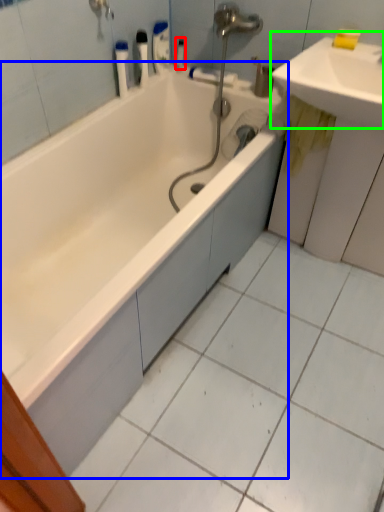
Question: Based on their relative distances, which object is farther from toiletry (highlighted by a red box)? Choose from bathtub (highlighted by a blue box) and sink (highlighted by a green box).

Choices:
 (A) bathtub
 (B) sink

Answer: (A)